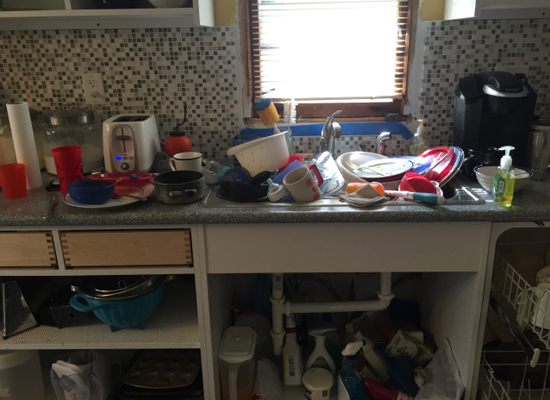
The image size is (550, 400). Find the location of `window`. window is located at coordinates (329, 29).